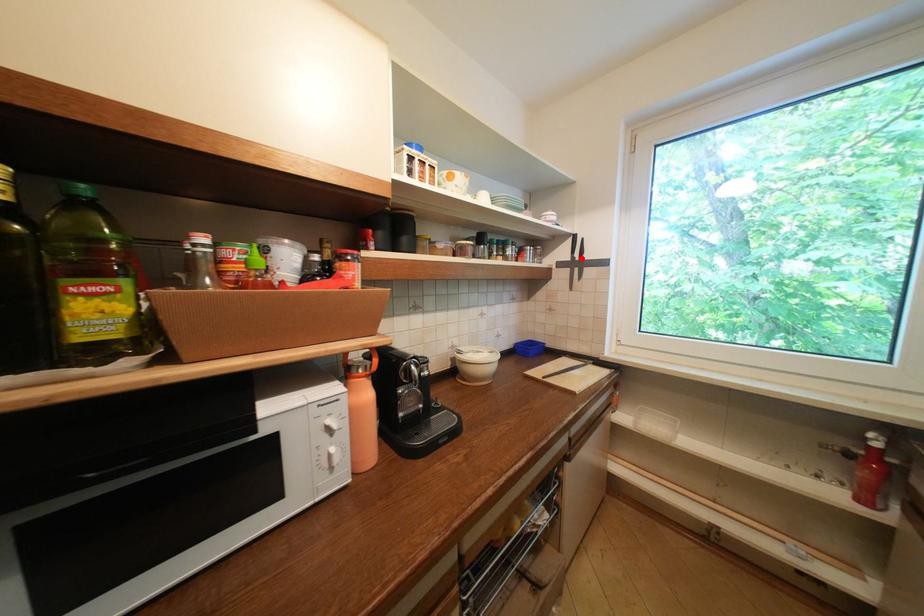
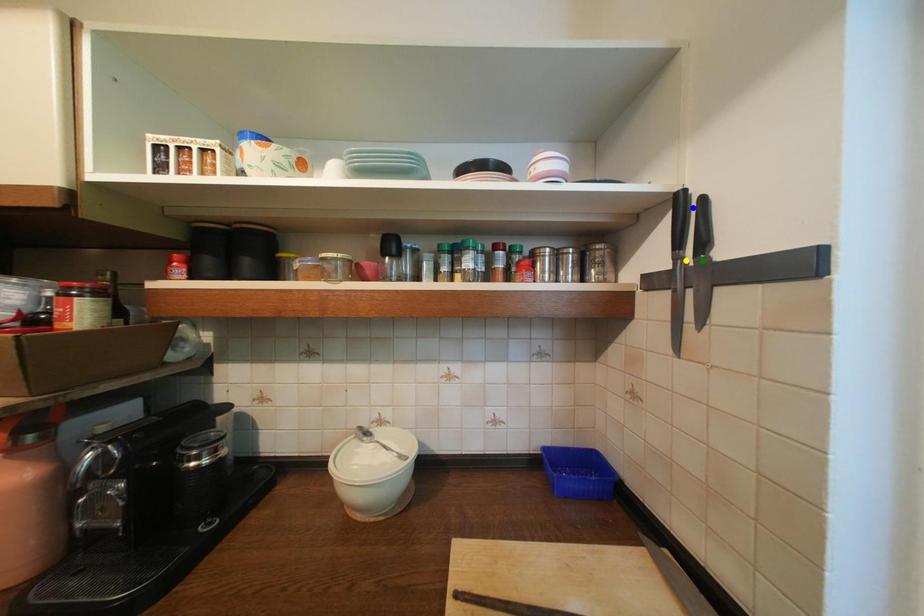
Question: I am providing you with two images of the same scene from different viewpoints. A red point is marked on the first image. You are given multiple points on the second image. Can you choose the point in image 2 that corresponds to the point in image 1?

Choices:
 (A) blue point
 (B) green point
 (C) yellow point

Answer: (C)